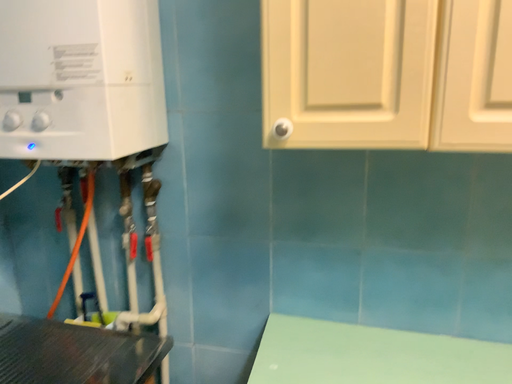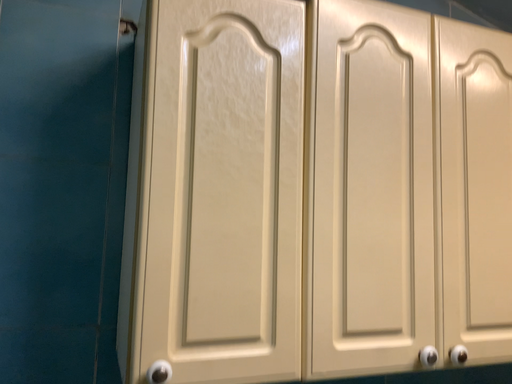
Question: Which way did the camera rotate in the video?

Choices:
 (A) rotated downward
 (B) rotated upward

Answer: (B)